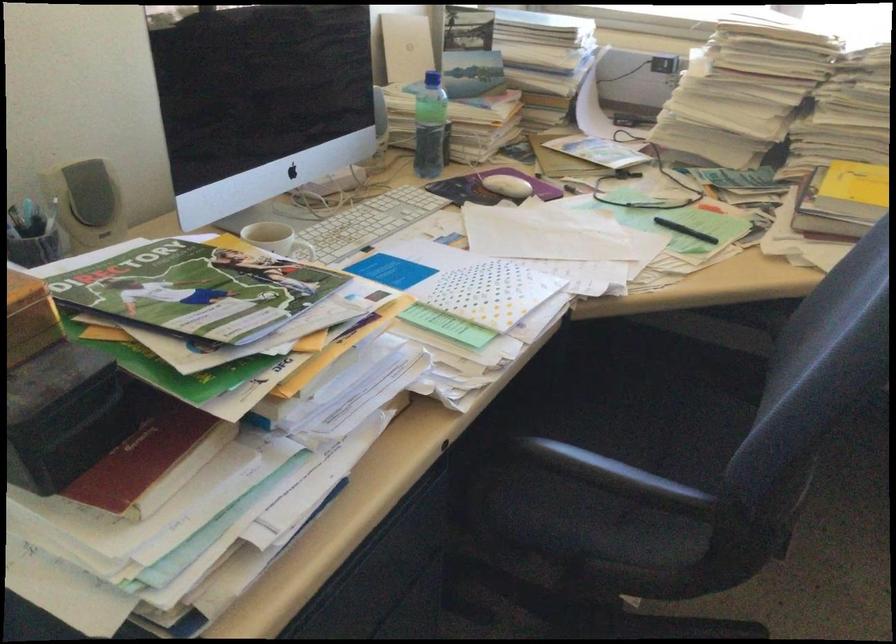
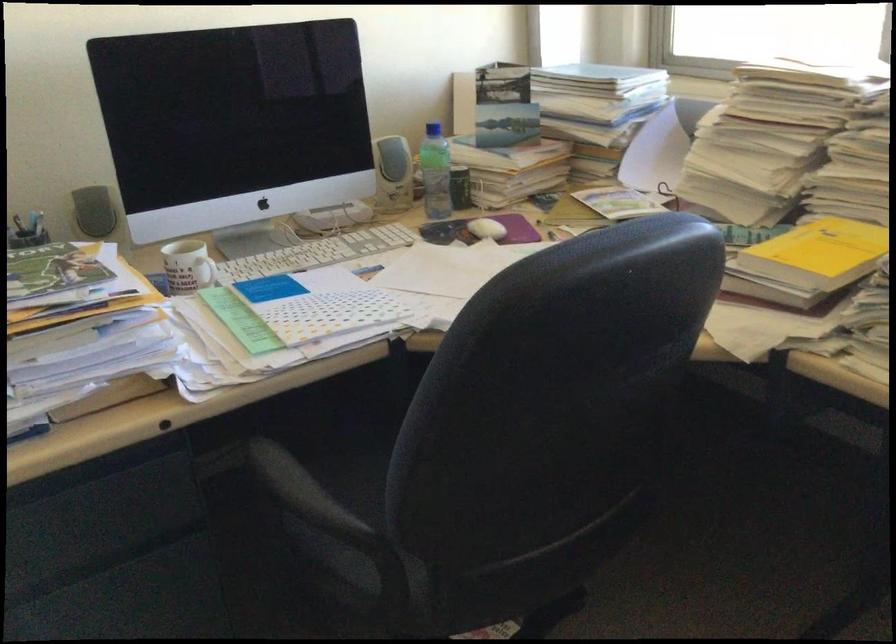
In the second image, find the point that corresponds to pixel 440 80 in the first image.

(433, 129)